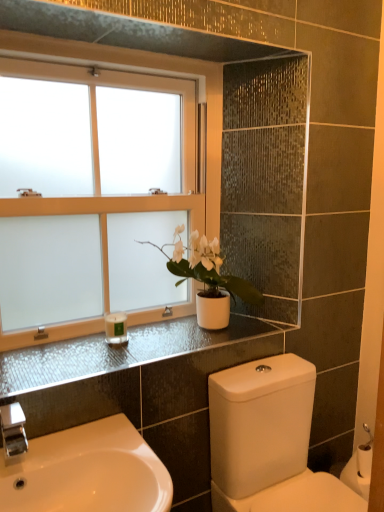
Question: Considering the positions of satin black countertop at upper center and white glossy toilet at lower right in the image, is satin black countertop at upper center taller or shorter than white glossy toilet at lower right?

Choices:
 (A) tall
 (B) short

Answer: (B)

Question: Is satin black countertop at upper center inside or outside of white glossy toilet at lower right?

Choices:
 (A) inside
 (B) outside

Answer: (B)

Question: Based on their relative distances, which object is farther from the white matte candle at lower left?

Choices:
 (A) white glossy sink at lower left
 (B) satin black countertop at upper center
 (C) white matte pot at center
 (D) white frosted glass window at upper left
 (E) white glossy toilet at lower right

Answer: (E)

Question: Which object is positioned farthest from the white matte pot at center?

Choices:
 (A) satin black countertop at upper center
 (B) white glossy sink at lower left
 (C) white glossy toilet at lower right
 (D) white matte candle at lower left
 (E) white frosted glass window at upper left

Answer: (B)